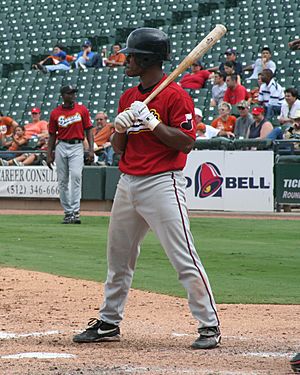
You are a GUI agent. You are given a task and a screenshot of the screen. Output one action in this format:
    pyautogui.click(x=<x>, y=<y>)
    Task: Click on the 2 areas of seating
    The width and height of the screenshot is (300, 375).
    Given the screenshot: What is the action you would take?
    pyautogui.click(x=212, y=18), pyautogui.click(x=69, y=38)